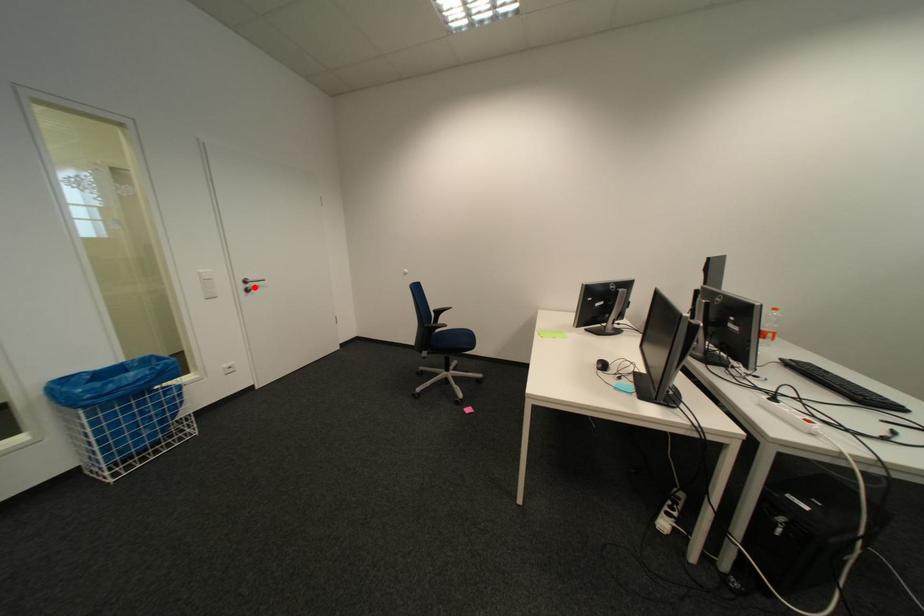
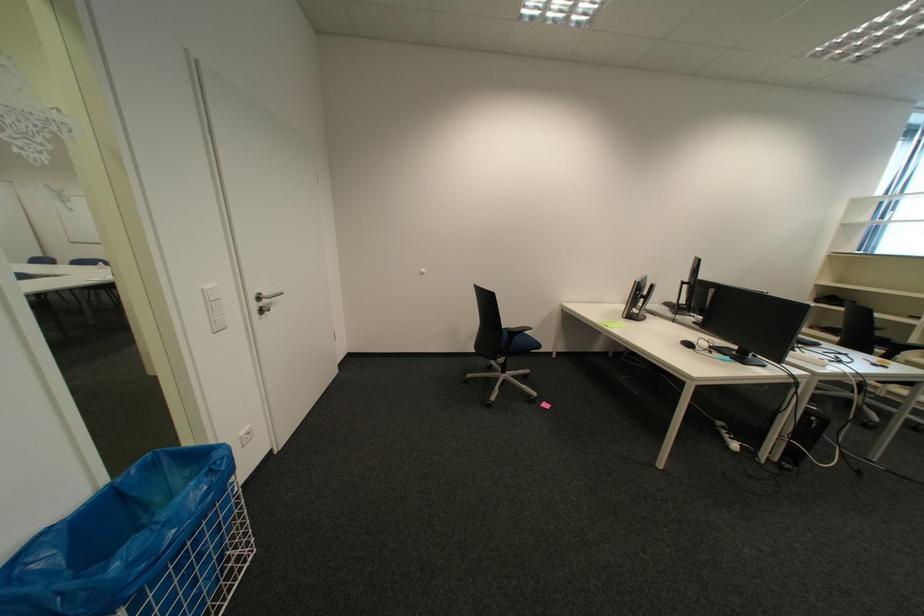
Where in the second image is the point corresponding to the highlighted location from the first image?

(266, 307)